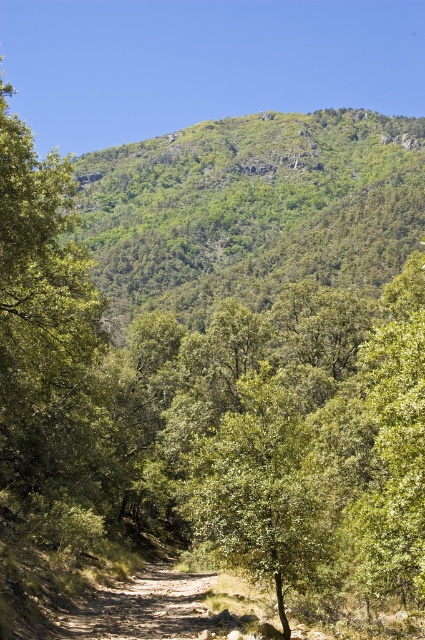
Question: Is green leafy hillside at upper center to the left of green leafy tree at center from the viewer's perspective?

Choices:
 (A) yes
 (B) no

Answer: (B)

Question: Which object is closer to the camera taking this photo?

Choices:
 (A) green leafy tree at center
 (B) green leafy hillside at upper center

Answer: (A)

Question: Is green leafy hillside at upper center to the left of green leafy tree at center from the viewer's perspective?

Choices:
 (A) yes
 (B) no

Answer: (B)

Question: From the image, what is the correct spatial relationship of green leafy hillside at upper center in relation to green leafy tree at center?

Choices:
 (A) left
 (B) right

Answer: (B)